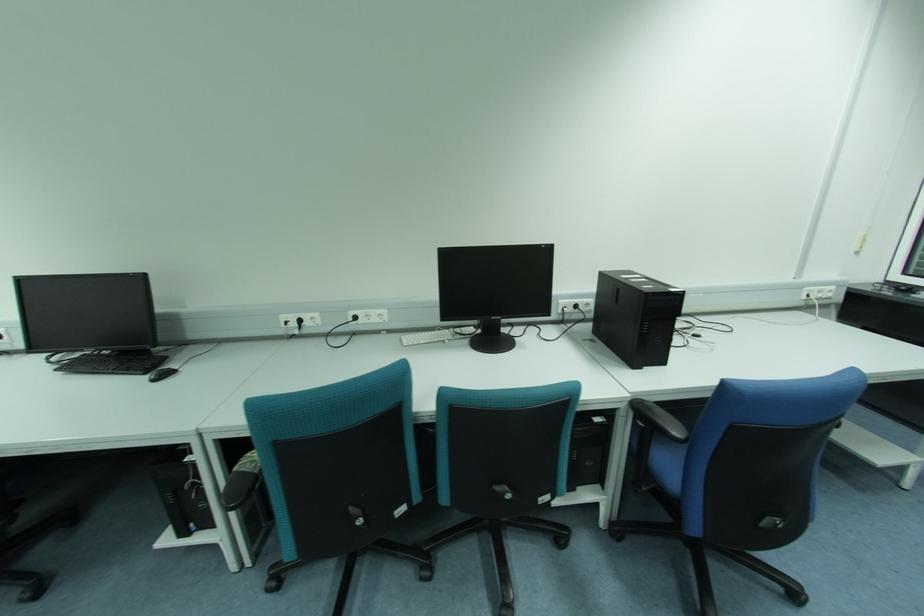
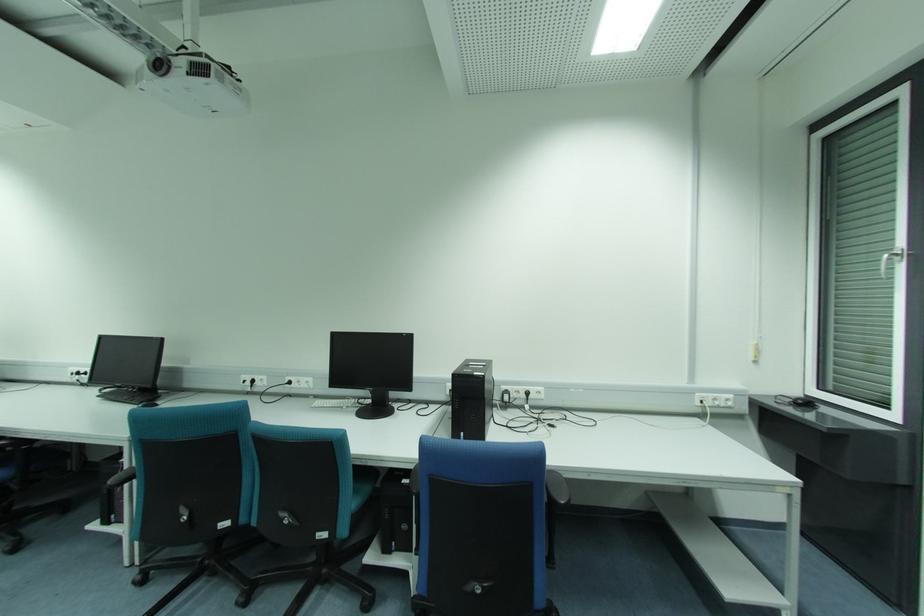
Find the pixel in the second image that matches pixel 444 342 in the first image.

(343, 408)